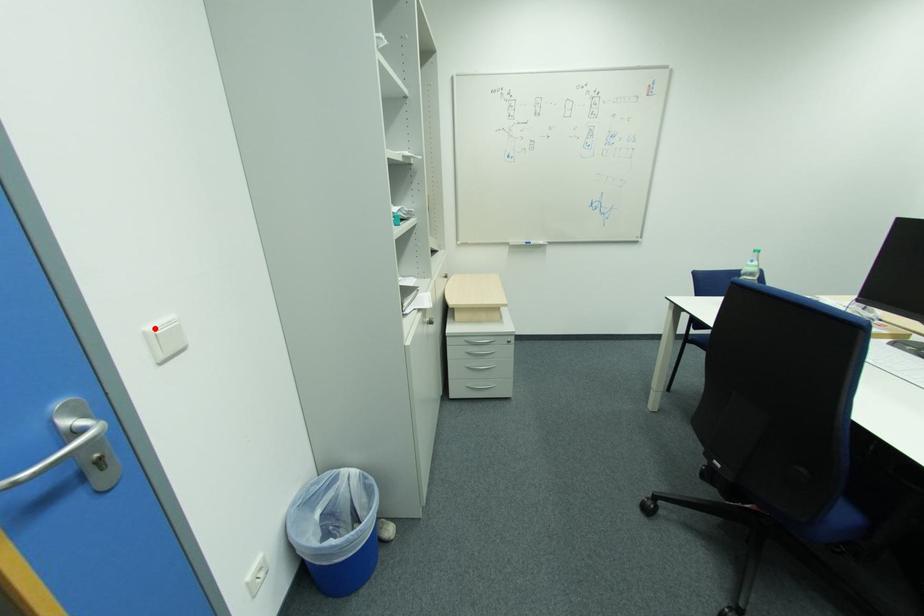
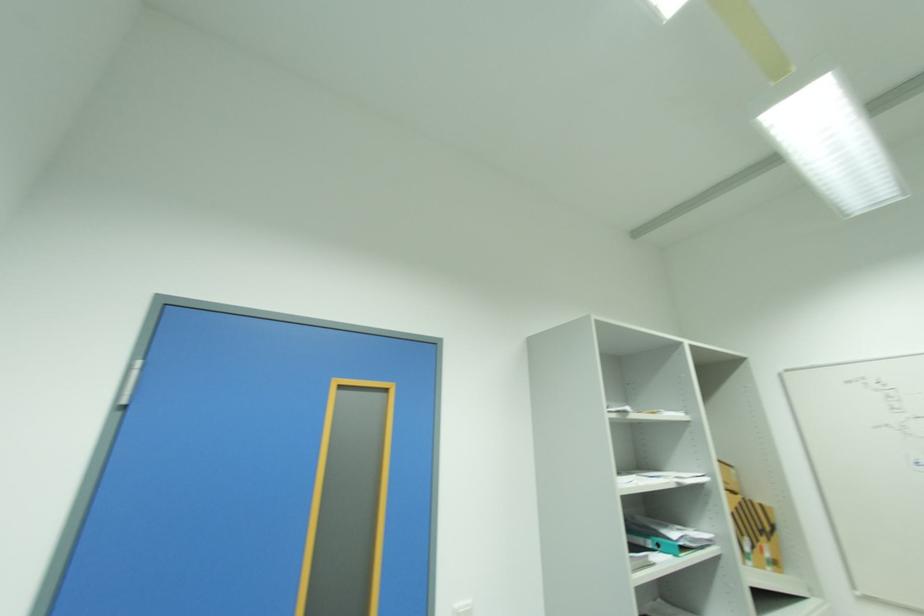
In the second image, find the point that corresponds to the highlighted location in the first image.

(463, 604)